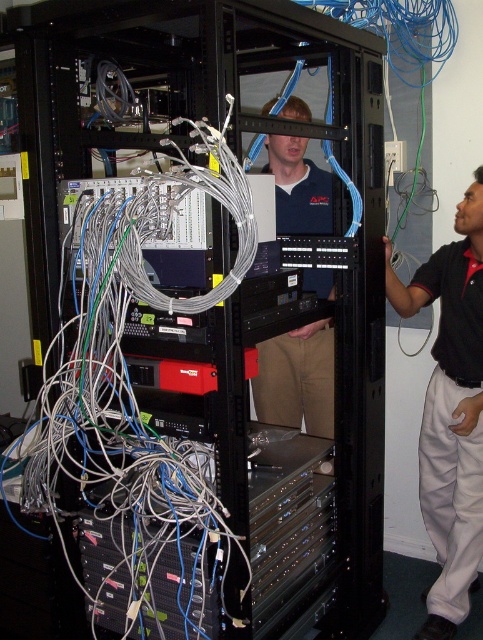
Question: Considering the relative positions of black cotton shirt at center and blue cotton shirt at center in the image provided, where is black cotton shirt at center located with respect to blue cotton shirt at center?

Choices:
 (A) left
 (B) right

Answer: (B)

Question: Can you confirm if black cotton shirt at center is positioned below blue cotton shirt at center?

Choices:
 (A) no
 (B) yes

Answer: (B)

Question: Is black cotton shirt at center positioned in front of blue cotton shirt at center?

Choices:
 (A) yes
 (B) no

Answer: (A)

Question: Which object appears farthest from the camera in this image?

Choices:
 (A) blue cotton shirt at center
 (B) black cotton shirt at center

Answer: (A)